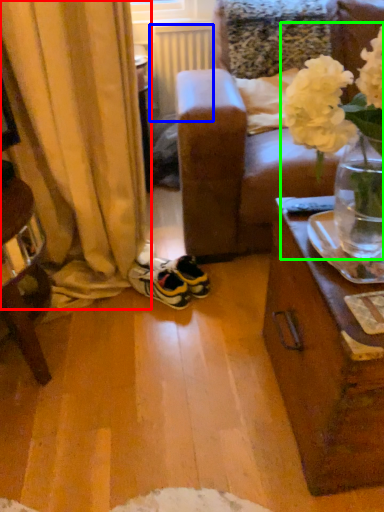
Question: Which is farther away from curtain (highlighted by a red box)? radiator (highlighted by a blue box) or floral arrangement (highlighted by a green box)?

Choices:
 (A) radiator
 (B) floral arrangement

Answer: (A)